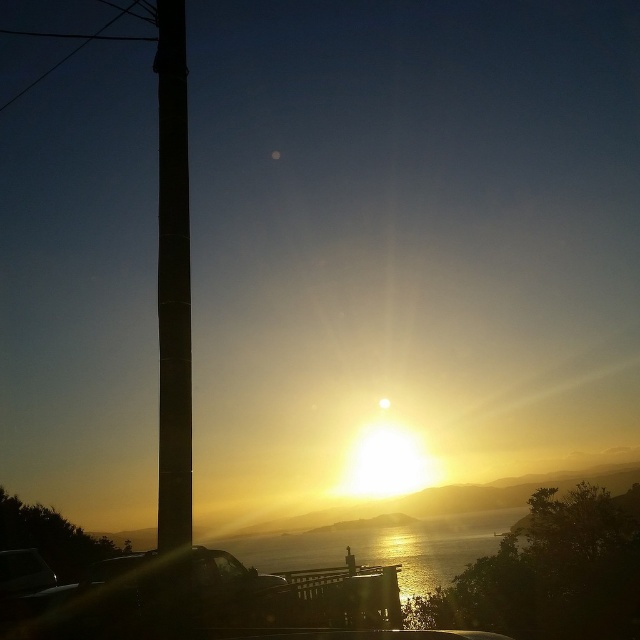
Question: Which point is closer to the camera?

Choices:
 (A) transparent glass car window at lower center
 (B) glistening reflective water at center
 (C) shiny black car at lower left

Answer: (C)

Question: Which object appears closest to the camera in this image?

Choices:
 (A) black smooth pole at left
 (B) transparent glass car window at lower center

Answer: (A)

Question: Does shiny black car at lower left have a larger size compared to black smooth pole at left?

Choices:
 (A) yes
 (B) no

Answer: (A)

Question: Which object is farther from the camera taking this photo?

Choices:
 (A) shiny black car at lower left
 (B) black smooth pole at left
 (C) glistening reflective water at center

Answer: (C)

Question: Observing the image, what is the correct spatial positioning of shiny black car at lower left in reference to glistening reflective water at center?

Choices:
 (A) right
 (B) left

Answer: (B)

Question: From the image, what is the correct spatial relationship of shiny black car at lower left in relation to glistening reflective water at center?

Choices:
 (A) left
 (B) right

Answer: (A)